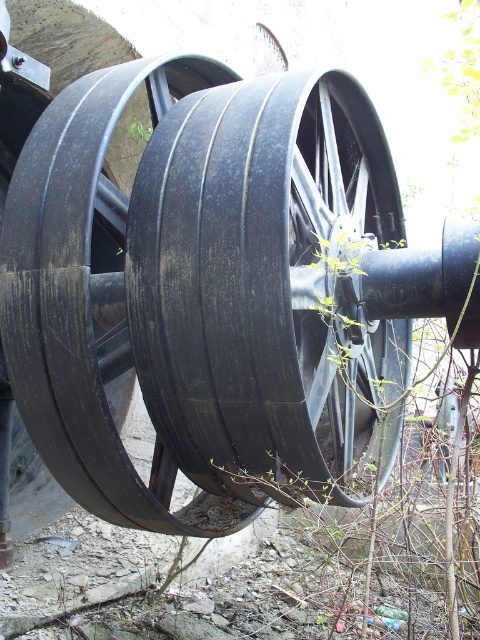
You are a mechanic inspecting an old machine. You notice two parts at the center of the machine labeled as the black rubber wheel at center and the black rubber tire at center. Which one has a smaller width?

The black rubber wheel at center is thinner than the black rubber tire at center, so the black rubber wheel at center has a smaller width.